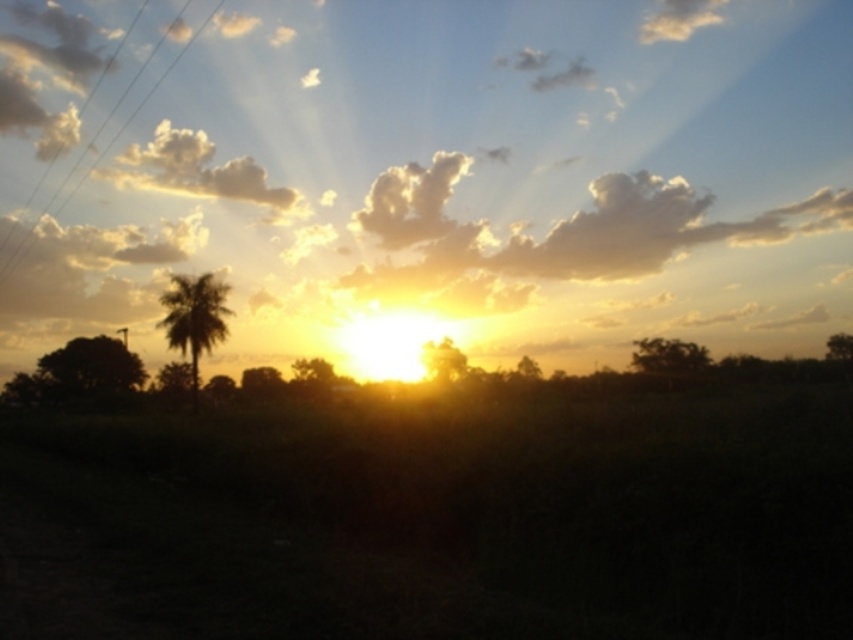
Is white fluffy cloud at upper left bigger than white fluffy cloud at upper center?

Indeed, white fluffy cloud at upper left has a larger size compared to white fluffy cloud at upper center.

Can you confirm if white fluffy cloud at upper left is wider than white fluffy cloud at upper center?

Yes.

Is point (198, 147) closer to camera compared to point (397, 220)?

No.

The width and height of the screenshot is (853, 640). Find the location of `white fluffy cloud at upper left`. white fluffy cloud at upper left is located at coordinates (194, 170).

Between white fluffy cloud at upper left and silhouette leafy palm at left, which one is positioned lower?

silhouette leafy palm at left

Who is more forward, (289, 200) or (181, 312)?

Positioned in front is point (181, 312).

Where is `white fluffy cloud at upper left`? This screenshot has height=640, width=853. white fluffy cloud at upper left is located at coordinates (194, 170).

Does white fluffy cloud at upper center have a greater width compared to silhouette leafy palm at left?

Yes.

Is point (459, 161) positioned after point (221, 282)?

Yes, it is behind point (221, 282).

At what (x,y) coordinates should I click in order to perform the action: click on white fluffy cloud at upper center. Please return your answer as a coordinate pair (x, y). Looking at the image, I should click on (410, 200).

I want to click on white fluffy cloud at upper center, so click(410, 200).